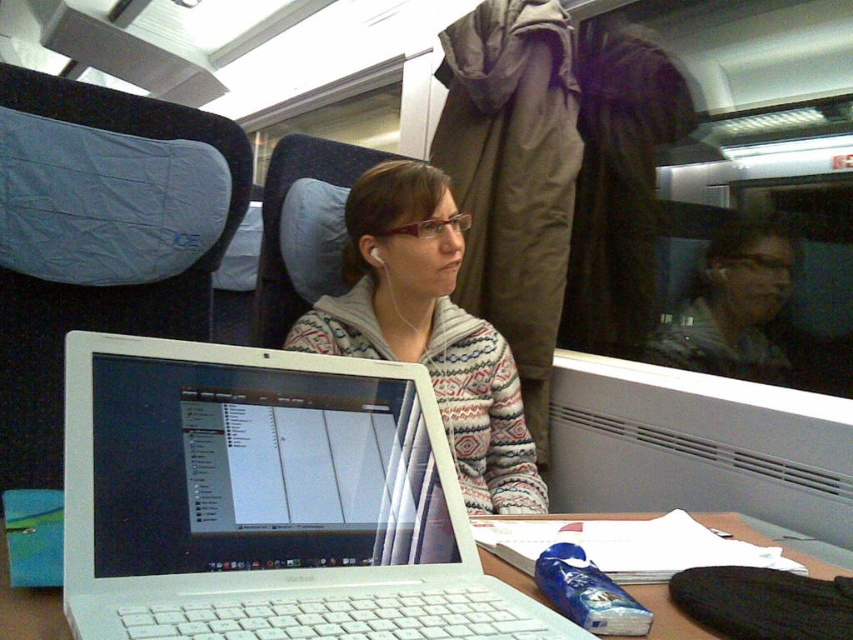
Question: From the image, what is the correct spatial relationship of white plastic laptop at center in relation to white plastic table at center?

Choices:
 (A) right
 (B) left

Answer: (B)

Question: Does white sweater at center appear over white plastic table at center?

Choices:
 (A) no
 (B) yes

Answer: (B)

Question: Which object appears closest to the camera in this image?

Choices:
 (A) white earphone at center
 (B) striped sweater at center
 (C) white sweater at center

Answer: (C)

Question: Does white plastic laptop at center have a lesser width compared to white sweater at center?

Choices:
 (A) no
 (B) yes

Answer: (B)

Question: Which object is farther from the camera taking this photo?

Choices:
 (A) white plastic table at center
 (B) white sweater at center

Answer: (B)

Question: Which object is closer to the camera taking this photo?

Choices:
 (A) striped sweater at center
 (B) white sweater at center
 (C) white plastic laptop at center

Answer: (C)